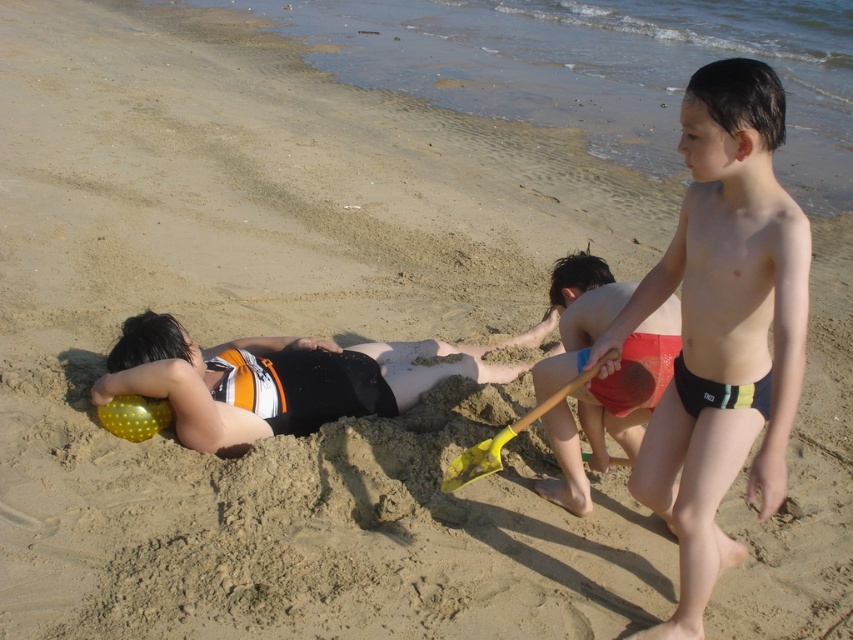
Question: Is yellow plastic shovel at center above yellow dotted ball at lower left?

Choices:
 (A) yes
 (B) no

Answer: (B)

Question: Which is farther from the yellow plastic shovel at center?

Choices:
 (A) black swimsuit at center
 (B) red fabric shorts at center
 (C) multicolored swim trunks at center

Answer: (A)

Question: Is black swimsuit at center positioned in front of yellow dotted ball at lower left?

Choices:
 (A) yes
 (B) no

Answer: (A)

Question: Which point appears closest to the camera in this image?

Choices:
 (A) (523, 413)
 (B) (721, 428)

Answer: (B)

Question: Does red fabric shorts at center appear on the left side of yellow plastic shovel at center?

Choices:
 (A) yes
 (B) no

Answer: (B)

Question: Based on their relative distances, which object is farther from the yellow plastic shovel at center?

Choices:
 (A) yellow dotted ball at lower left
 (B) black swimsuit at center
 (C) multicolored swim trunks at center
 (D) red fabric shorts at center

Answer: (A)